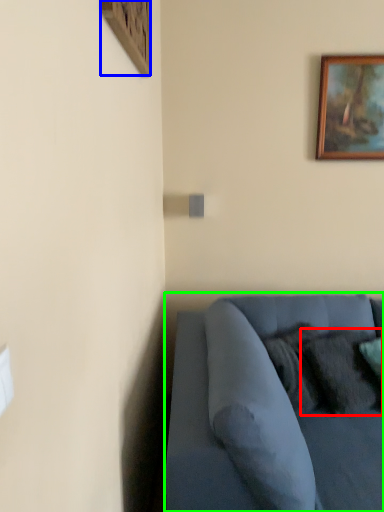
Question: Based on their relative distances, which object is farther from pillow (highlighted by a red box)? Choose from picture frame (highlighted by a blue box) and studio couch (highlighted by a green box).

Choices:
 (A) picture frame
 (B) studio couch

Answer: (A)